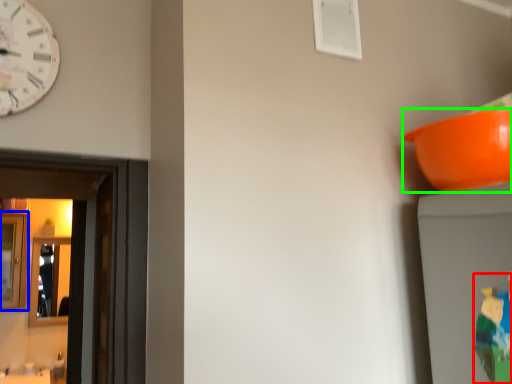
Question: Considering the real-world distances, which object is closest to toy (highlighted by a red box)? mirror (highlighted by a blue box) or bowl (highlighted by a green box).

Choices:
 (A) mirror
 (B) bowl

Answer: (B)